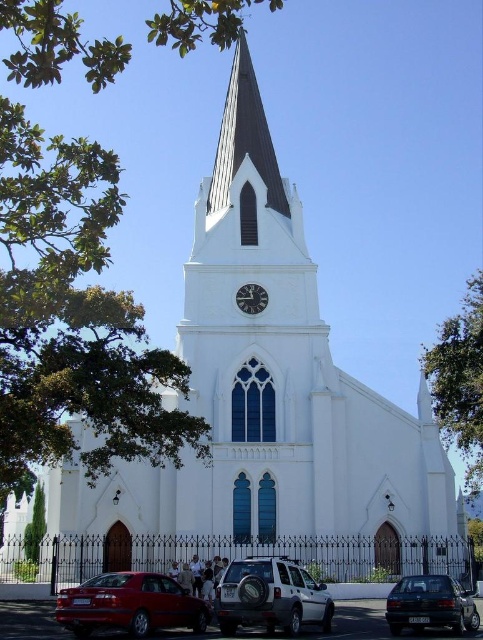
Question: Does silver metallic suv at center lie in front of dark gray metallic sedan at lower right?

Choices:
 (A) yes
 (B) no

Answer: (A)

Question: Which point is closer to the camera?

Choices:
 (A) silver metallic suv at center
 (B) dark gray metallic sedan at lower right
 (C) shiny red sedan at lower left
 (D) metallic clock face at center

Answer: (A)

Question: Among these objects, which one is nearest to the camera?

Choices:
 (A) silver metallic suv at center
 (B) shiny red sedan at lower left

Answer: (A)

Question: Is the position of dark gray metallic sedan at lower right less distant than that of metallic clock face at center?

Choices:
 (A) yes
 (B) no

Answer: (A)

Question: Where is shiny red sedan at lower left located in relation to shiny black spire at center in the image?

Choices:
 (A) below
 (B) above

Answer: (A)

Question: Which of these objects is positioned farthest from the metallic clock face at center?

Choices:
 (A) dark gray metallic sedan at lower right
 (B) silver metallic suv at center
 (C) shiny black spire at center
 (D) shiny red sedan at lower left

Answer: (A)